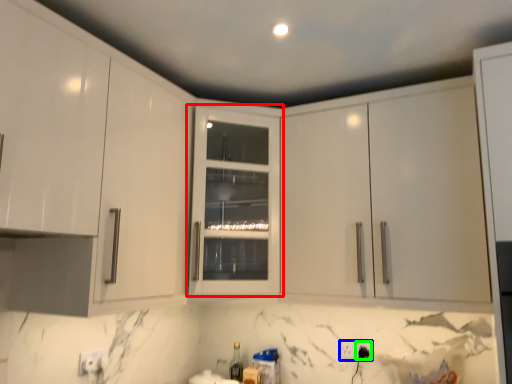
Question: Estimate the real-world distances between objects in this image. Which object is closer to cabinetry (highlighted by a red box), electric outlet (highlighted by a blue box) or electric outlet (highlighted by a green box)?

Choices:
 (A) electric outlet
 (B) electric outlet

Answer: (A)